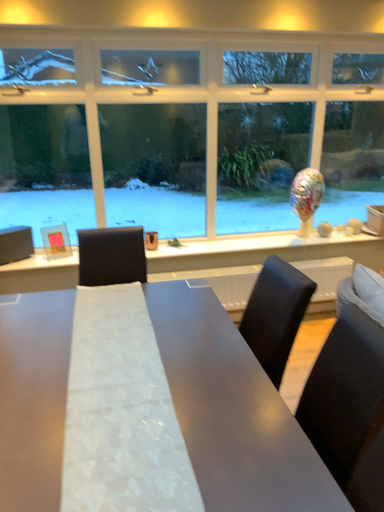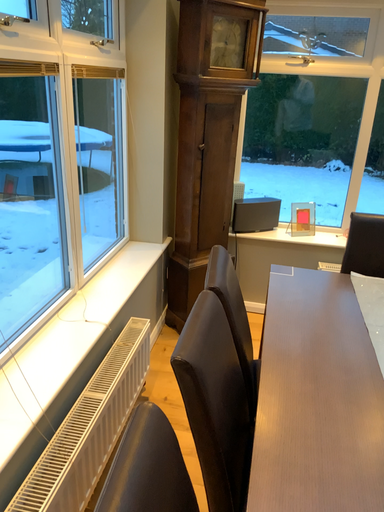
Question: Which way did the camera rotate in the video?

Choices:
 (A) rotated right
 (B) rotated left

Answer: (B)